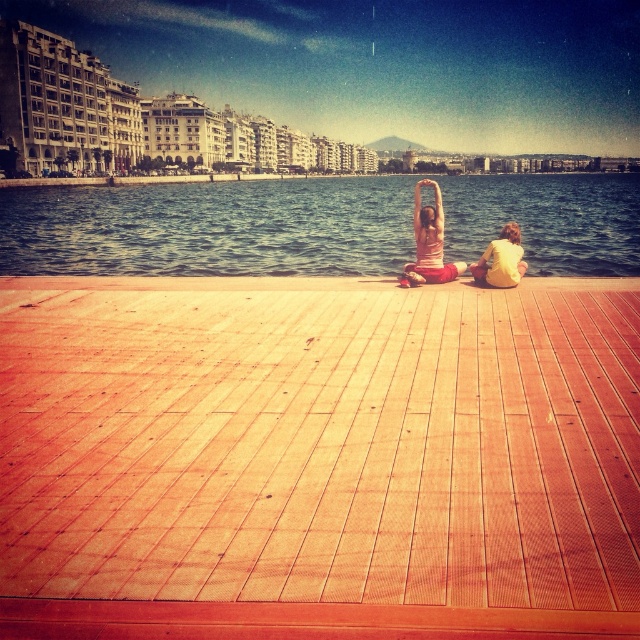
Question: Is blue water at center above yellow cotton shirt at lower right?

Choices:
 (A) no
 (B) yes

Answer: (B)

Question: Which point is closer to the camera?

Choices:
 (A) blue water at center
 (B) wooden at center
 (C) pink fabric at center

Answer: (B)

Question: Can you confirm if blue water at center is positioned to the left of yellow cotton shirt at lower right?

Choices:
 (A) yes
 (B) no

Answer: (B)

Question: Which is nearer to the wooden at center?

Choices:
 (A) blue water at center
 (B) pink fabric at center

Answer: (B)

Question: Which of the following is the closest to the observer?

Choices:
 (A) wooden at center
 (B) yellow cotton shirt at lower right
 (C) blue water at center
 (D) pink fabric at center

Answer: (A)

Question: Is blue water at center above pink fabric at center?

Choices:
 (A) yes
 (B) no

Answer: (A)